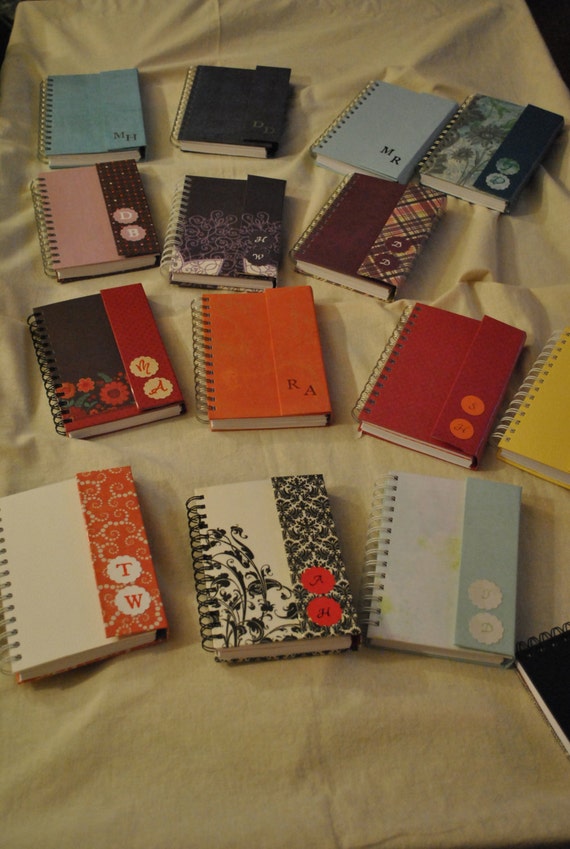
This screenshot has width=570, height=849. I want to click on cloth background, so click(x=367, y=722).